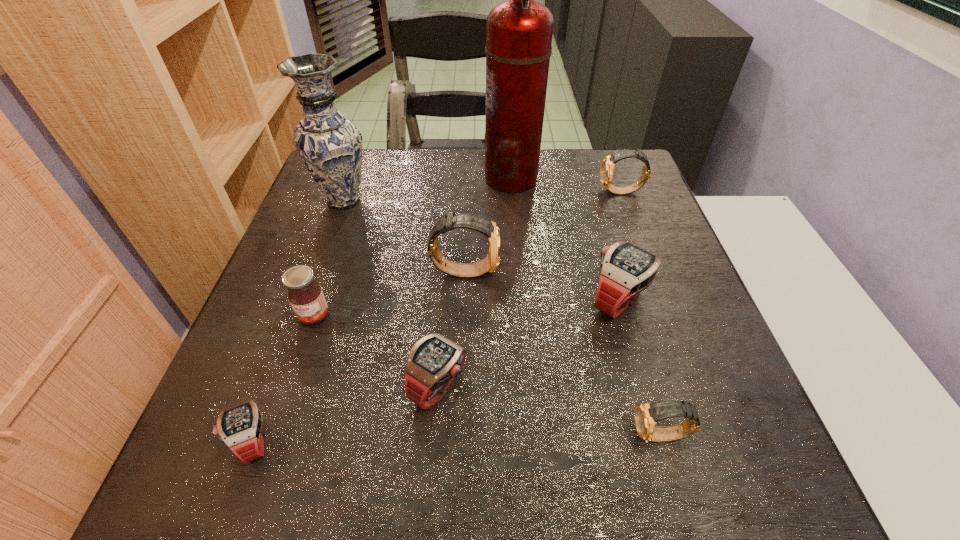
In order to click on free space between the smallest gold watch and the farthest watch in this screenshot , I will do pos(641,314).

This screenshot has width=960, height=540. I want to click on free space between the red fire extinguisher and the shortest watch, so tap(382, 309).

At what (x,y) coordinates should I click in order to perform the action: click on vacant space in between the farthest red watch and the second biggest red watch. Please return your answer as a coordinate pair (x, y). Looking at the image, I should click on (529, 343).

Identify the location of empty space between the leftmost gold watch and the smallest gold watch. The image size is (960, 540). (563, 353).

Identify the location of free area in between the biggest gold watch and the second biggest gold watch. (542, 232).

Image resolution: width=960 pixels, height=540 pixels. What are the coordinates of `free point between the second biggest red watch and the shortest object` in the screenshot? It's located at (347, 413).

Select which object is the sixth closest to the smallest gold watch. Please provide its 2D coordinates. Your answer should be formatted as a tuple, i.e. [(x, y)], where the tuple contains the x and y coordinates of a point satisfying the conditions above.

[(606, 171)]

You are a GUI agent. You are given a task and a screenshot of the screen. Output one action in this format:
    pyautogui.click(x=<x>, y=<y>)
    Task: Click on the third closest object to the leftmost watch
    This screenshot has width=960, height=540.
    Given the screenshot: What is the action you would take?
    pyautogui.click(x=479, y=223)

The image size is (960, 540). Find the location of `the fifth closest watch to the jam`. the fifth closest watch to the jam is located at coordinates (647, 415).

This screenshot has width=960, height=540. Identify the location of watch that is the sixth closest to the jam. (606, 171).